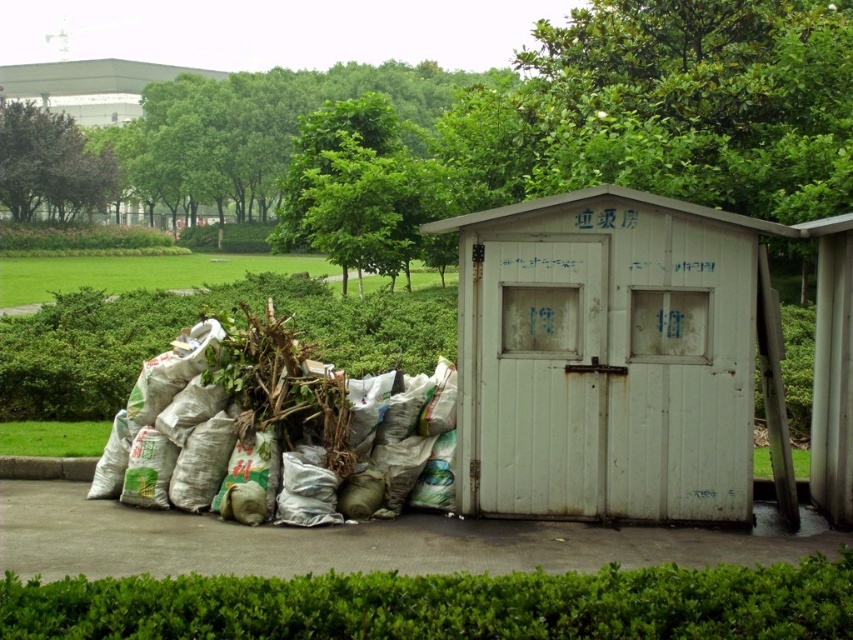
You are standing in front of the shed and want to place a new item in the area. You have a box that needs to be placed either on top of the white cardboard hut at upper left or under the white fabric bags at center. Based on their positions, where should you place the box?

The white fabric bags at center is located below the white cardboard hut at upper left, so you should place the box under the white fabric bags at center since it is already positioned lower.

You are standing in the outdoor area and want to place a new bench between the white painted wood hut at center and the green leafy tree at upper center. Based on their positions, will the bench be closer to the tree or the shed?

The white painted wood hut at center is below the green leafy tree at upper center, so the bench placed between them will be closer to the shed since the tree is higher up.